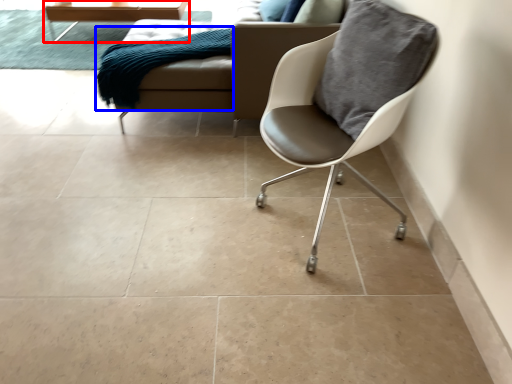
Question: Which point is further to the camera, table (highlighted by a red box) or material (highlighted by a blue box)?

Choices:
 (A) table
 (B) material

Answer: (A)